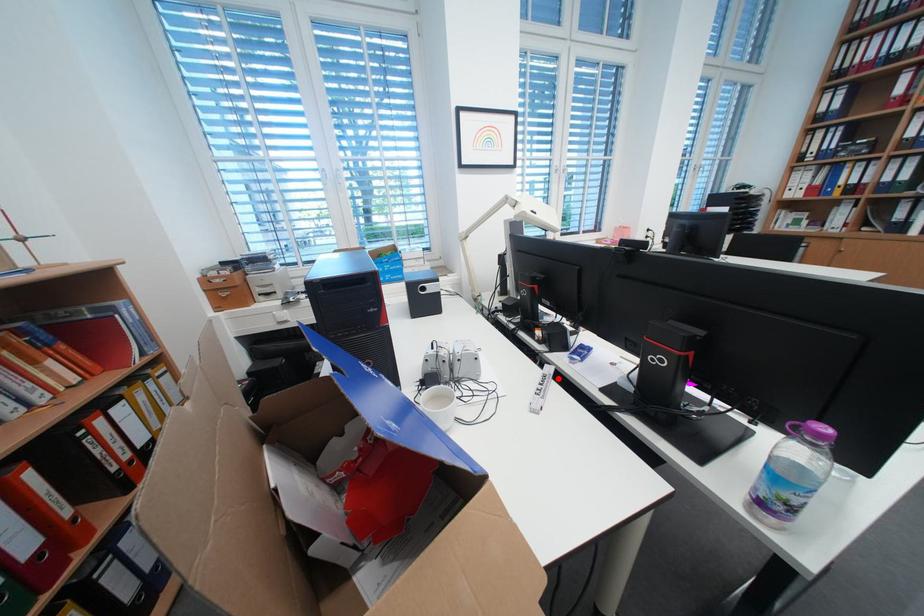
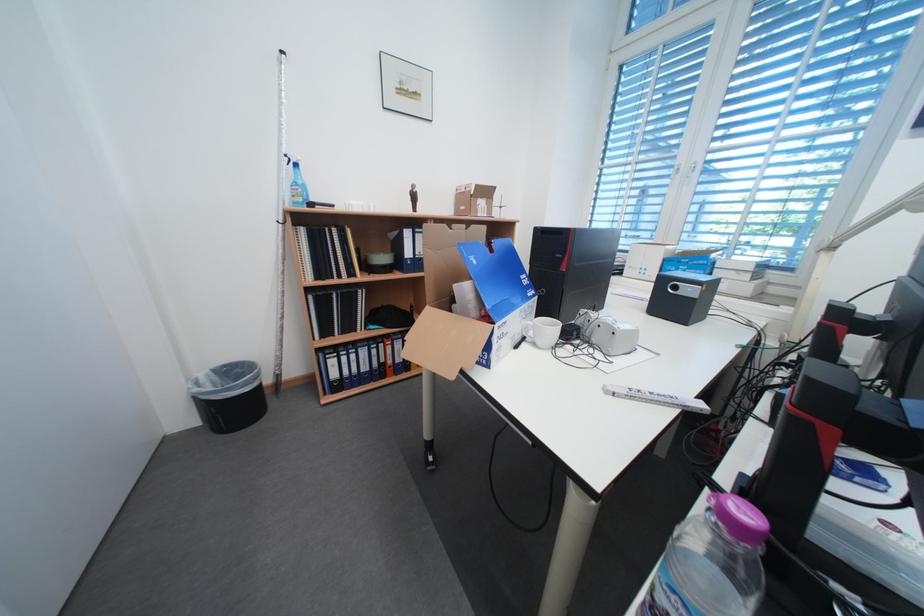
Find the pixel in the second image that matches the highlighted location in the first image.

(685, 400)